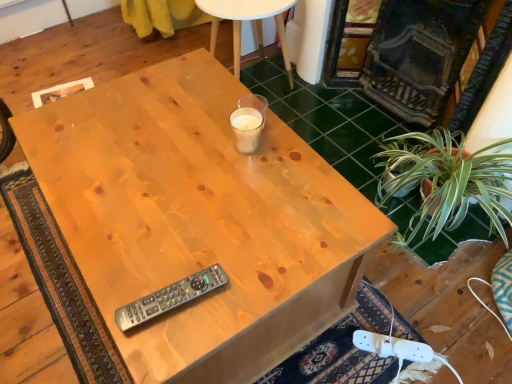
The image size is (512, 384). In order to click on vacant area to the left of gray plastic remote at center in this screenshot , I will do `click(112, 277)`.